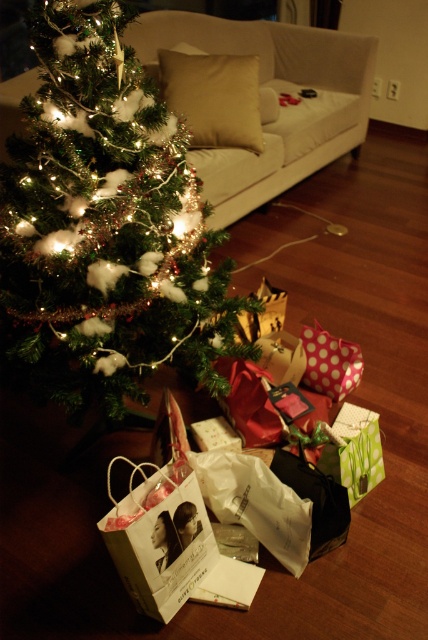
In the scene shown: You are holding a camera and want to take a photo of the green matte christmas tree at left. If you are standing 1.29 meters away from the tree, is that within the minimum focusing distance of most standard cameras?

The green matte christmas tree at left and camera are 1.29 meters apart. Most standard cameras have a minimum focusing distance of about 0.3 meters, so 1.29 meters is well within the safe range for clear focusing.